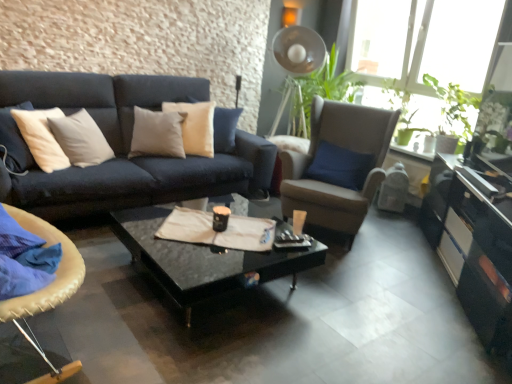
Question: Are matte black coffee cup at center and black glossy coffee table at center located far from each other?

Choices:
 (A) no
 (B) yes

Answer: (A)

Question: Is matte black coffee cup at center oriented towards black glossy coffee table at center?

Choices:
 (A) no
 (B) yes

Answer: (A)

Question: From a real-world perspective, is matte black coffee cup at center located higher than black glossy coffee table at center?

Choices:
 (A) no
 (B) yes

Answer: (B)

Question: Does matte black coffee cup at center have a greater height compared to black glossy coffee table at center?

Choices:
 (A) no
 (B) yes

Answer: (A)

Question: Is matte black coffee cup at center further to camera compared to black glossy coffee table at center?

Choices:
 (A) no
 (B) yes

Answer: (B)

Question: Can you confirm if matte black coffee cup at center is thinner than black glossy coffee table at center?

Choices:
 (A) yes
 (B) no

Answer: (A)

Question: Does suede-like beige armchair at center-right, the second chair from the left, have a lesser height compared to black glossy coffee table at center?

Choices:
 (A) no
 (B) yes

Answer: (A)

Question: From the image's perspective, is suede-like beige armchair at center-right, the second chair from the front, on top of black glossy coffee table at center?

Choices:
 (A) no
 (B) yes

Answer: (B)

Question: From the image's perspective, does suede-like beige armchair at center-right, the 1th chair viewed from the right, appear lower than black glossy coffee table at center?

Choices:
 (A) no
 (B) yes

Answer: (A)

Question: From a real-world perspective, is suede-like beige armchair at center-right, the second chair from the front, located higher than black glossy coffee table at center?

Choices:
 (A) no
 (B) yes

Answer: (B)

Question: Is the position of suede-like beige armchair at center-right, the second chair from the left, less distant than that of black glossy coffee table at center?

Choices:
 (A) no
 (B) yes

Answer: (A)

Question: Is suede-like beige armchair at center-right, the second chair from the left, smaller than black glossy coffee table at center?

Choices:
 (A) no
 (B) yes

Answer: (A)

Question: Can you confirm if glossy black cabinet at lower right is taller than matte black coffee cup at center?

Choices:
 (A) no
 (B) yes

Answer: (B)